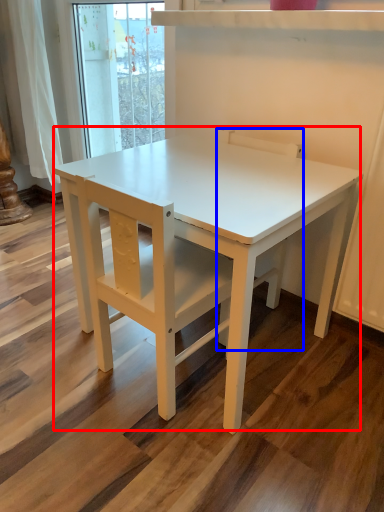
Question: Which object is further to the camera taking this photo, table (highlighted by a red box) or chair (highlighted by a blue box)?

Choices:
 (A) table
 (B) chair

Answer: (B)